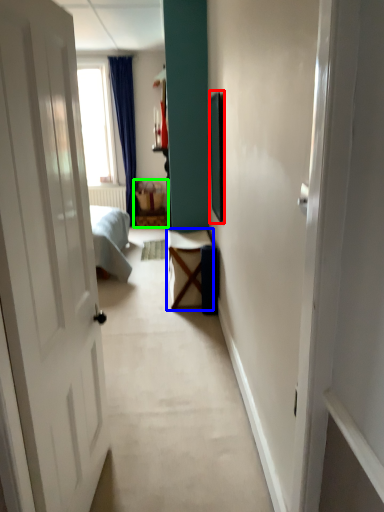
Question: Based on their relative distances, which object is nearer to picture frame (highlighted by a red box)? Choose from table (highlighted by a blue box) and furniture (highlighted by a green box).

Choices:
 (A) table
 (B) furniture

Answer: (A)